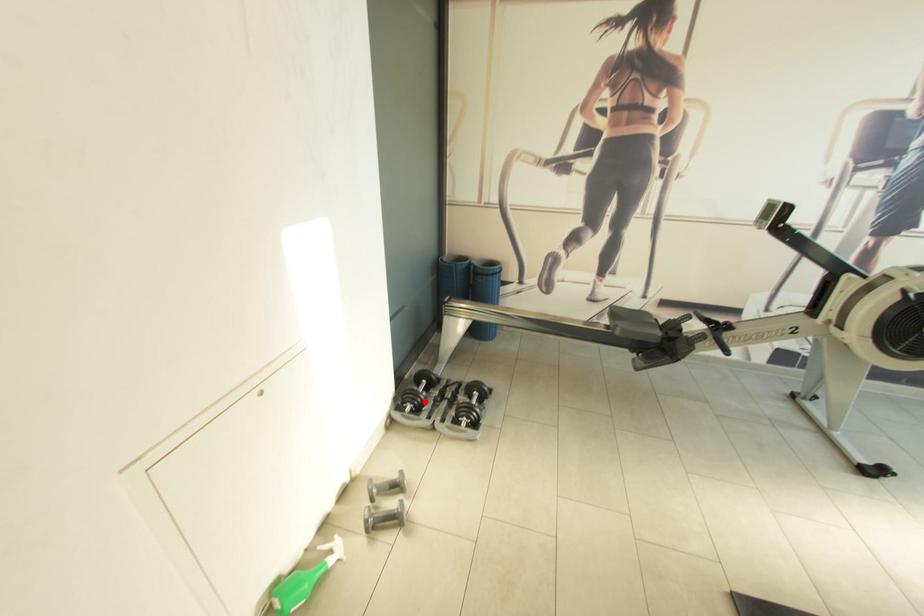
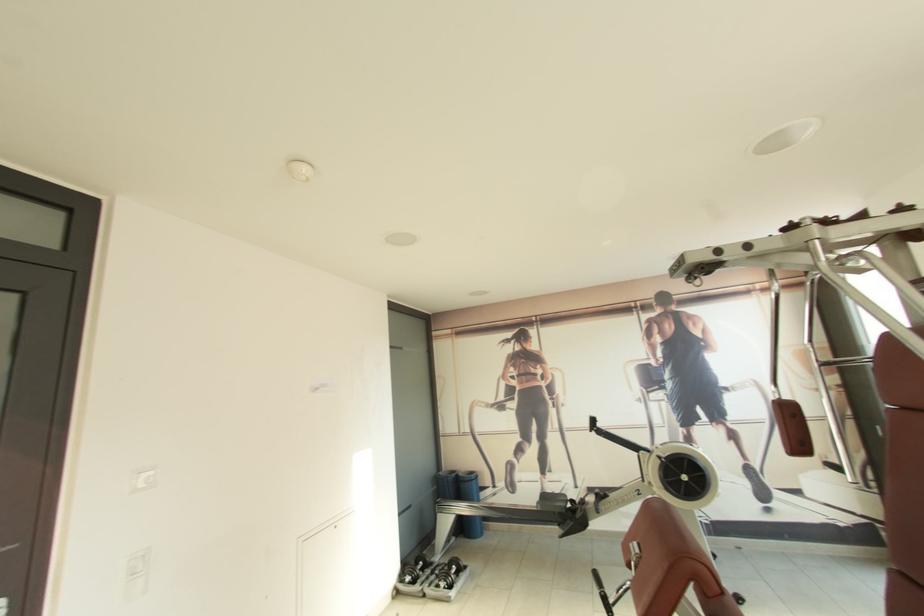
Question: A red point is marked in image1. In image2, is the corresponding 3D point closer to the camera or farther? Reply with the corresponding letter.

Choices:
 (A) The corresponding 3D point is closer.
 (B) The corresponding 3D point is farther.

Answer: (A)